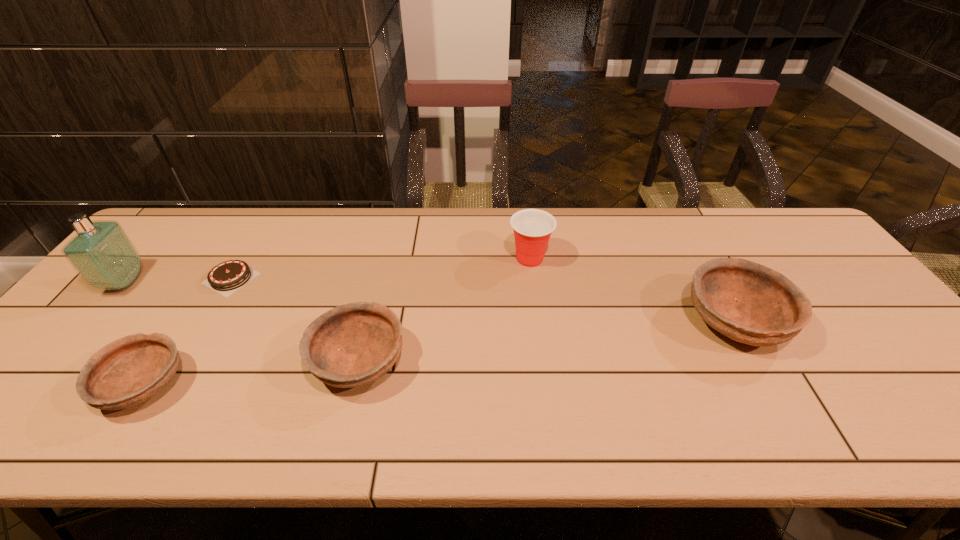
At what (x,y) coordinates should I click in order to perform the action: click on free region located on the right of the shortest bowl. Please return your answer as a coordinate pair (x, y). The width and height of the screenshot is (960, 540). Looking at the image, I should click on (252, 386).

Locate an element on the screen. free space located 0.130m on the right of the fourth tallest object is located at coordinates tap(461, 362).

Locate an element on the screen. The image size is (960, 540). free spot located on the back of the rightmost object is located at coordinates (676, 217).

Identify the location of free space located on the right of the second object from right to left. This screenshot has height=540, width=960. (606, 259).

Where is `free region located on the front of the chocolate cake`? free region located on the front of the chocolate cake is located at coordinates point(156,402).

Locate an element on the screen. free point located on the front label of the leftmost object is located at coordinates (163, 282).

You are a GUI agent. You are given a task and a screenshot of the screen. Output one action in this format:
    pyautogui.click(x=<x>, y=<y>)
    Task: Click on the object present at the far edge
    Image resolution: width=960 pixels, height=540 pixels.
    Given the screenshot: What is the action you would take?
    pyautogui.click(x=532, y=228)

I want to click on object that is at the left edge, so click(103, 255).

You are a GUI agent. You are given a task and a screenshot of the screen. Output one action in this format:
    pyautogui.click(x=<x>, y=<y>)
    Task: Click on the free space at the far edge of the desktop
    
    Given the screenshot: What is the action you would take?
    click(x=348, y=232)

Identify the location of free space at the left edge of the desktop. (149, 290).